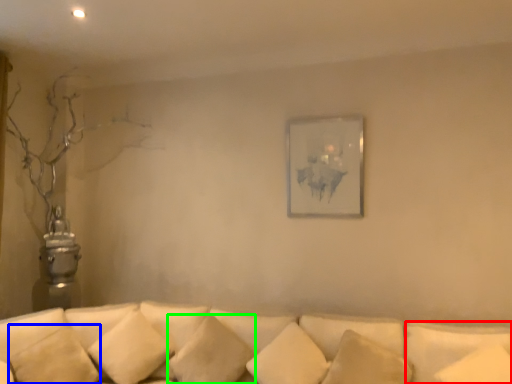
Question: Considering the real-world distances, which object is farthest from pillow (highlighted by a red box)? pillow (highlighted by a blue box) or pillow (highlighted by a green box)?

Choices:
 (A) pillow
 (B) pillow

Answer: (A)